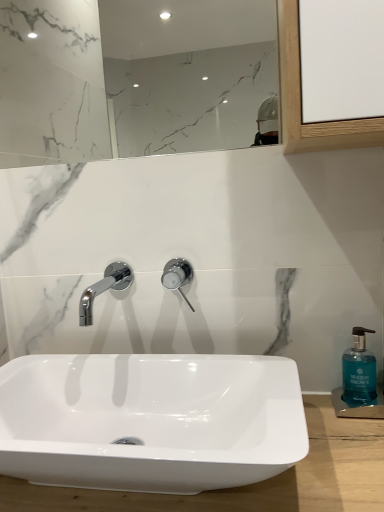
Question: From the image's perspective, would you say polished chrome tap at center is positioned over white marble mirror at upper center?

Choices:
 (A) no
 (B) yes

Answer: (A)

Question: Considering the relative positions of polished chrome tap at center and white marble mirror at upper center in the image provided, is polished chrome tap at center to the left of white marble mirror at upper center from the viewer's perspective?

Choices:
 (A) yes
 (B) no

Answer: (B)

Question: Is polished chrome tap at center surrounding white marble mirror at upper center?

Choices:
 (A) yes
 (B) no

Answer: (B)

Question: From a real-world perspective, is polished chrome tap at center over white marble mirror at upper center?

Choices:
 (A) no
 (B) yes

Answer: (A)

Question: Is polished chrome tap at center to the right of white marble mirror at upper center from the viewer's perspective?

Choices:
 (A) no
 (B) yes

Answer: (B)

Question: Considering their positions, is teal glass soap dispenser at right located in front of or behind polished chrome tap at center?

Choices:
 (A) behind
 (B) front

Answer: (B)

Question: Considering the positions of teal glass soap dispenser at right and polished chrome tap at center in the image, is teal glass soap dispenser at right wider or thinner than polished chrome tap at center?

Choices:
 (A) wide
 (B) thin

Answer: (A)

Question: From a real-world perspective, relative to polished chrome tap at center, is teal glass soap dispenser at right vertically above or below?

Choices:
 (A) below
 (B) above

Answer: (A)

Question: In terms of size, does teal glass soap dispenser at right appear bigger or smaller than polished chrome tap at center?

Choices:
 (A) big
 (B) small

Answer: (A)

Question: From a real-world perspective, is polished chrome tap at center positioned above or below white marble mirror at upper center?

Choices:
 (A) below
 (B) above

Answer: (A)

Question: From the image's perspective, is polished chrome tap at center located above or below white marble mirror at upper center?

Choices:
 (A) above
 (B) below

Answer: (B)

Question: In terms of height, does polished chrome tap at center look taller or shorter compared to white marble mirror at upper center?

Choices:
 (A) tall
 (B) short

Answer: (B)

Question: Would you say polished chrome tap at center is to the left or to the right of white marble mirror at upper center in the picture?

Choices:
 (A) left
 (B) right

Answer: (B)

Question: Is polished chrome tap at center wider or thinner than white glossy sink at center?

Choices:
 (A) thin
 (B) wide

Answer: (A)

Question: Based on their positions, is polished chrome tap at center located to the left or right of white glossy sink at center?

Choices:
 (A) left
 (B) right

Answer: (B)